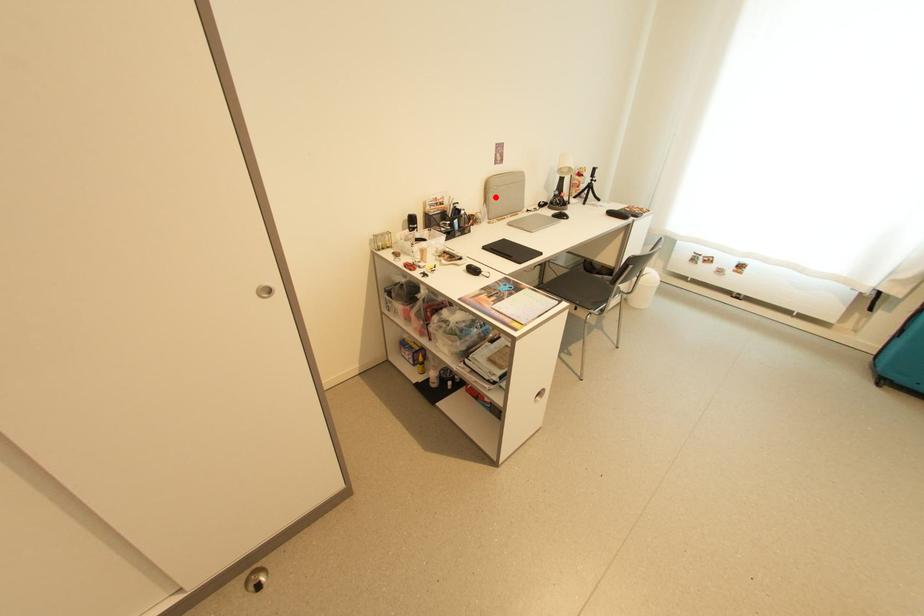
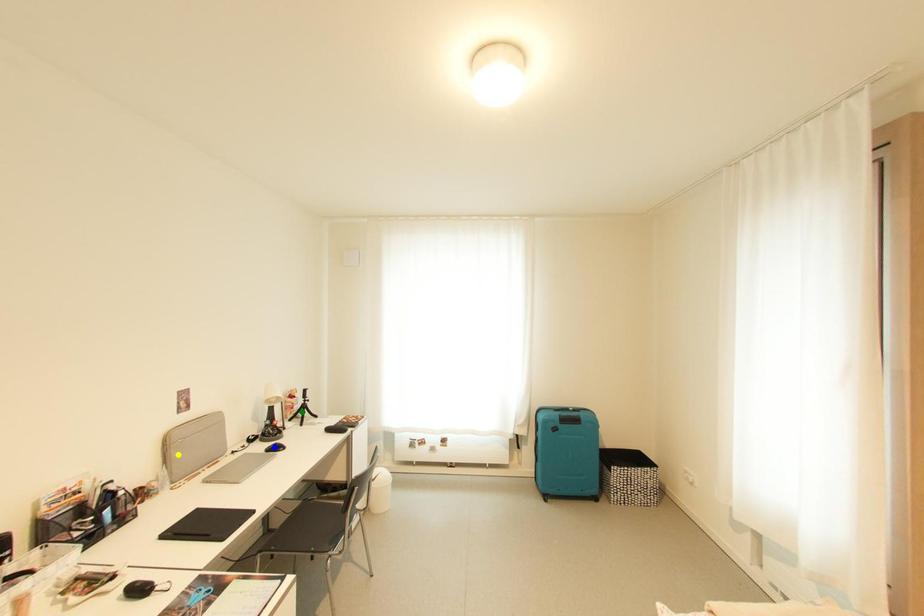
Question: I am providing you with two images of the same scene from different viewpoints. A red point is marked on the first image. You are given multiple points on the second image. In image 2, which mark is for the same physical point as the one in image 1?

Choices:
 (A) green point
 (B) blue point
 (C) yellow point

Answer: (C)